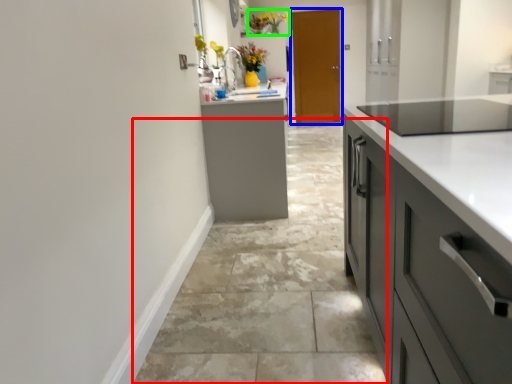
Question: Which object is the farthest from concrete (highlighted by a red box)? Choose among these: door (highlighted by a blue box) or floral arrangement (highlighted by a green box).

Choices:
 (A) door
 (B) floral arrangement

Answer: (B)